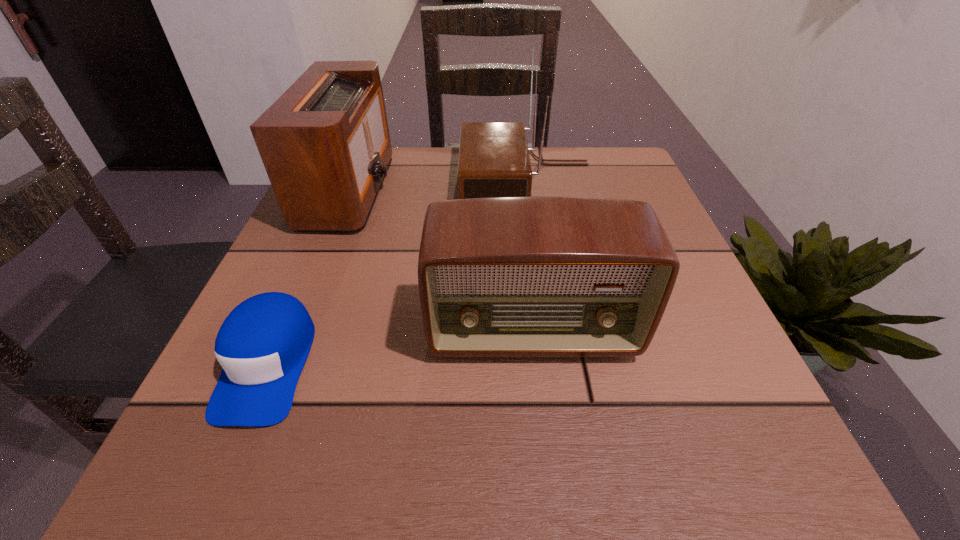
Locate which object ranks second in proximity to the nearest radio receiver. Please provide its 2D coordinates. Your answer should be formatted as a tuple, i.e. [(x, y)], where the tuple contains the x and y coordinates of a point satisfying the conditions above.

[(325, 144)]

Identify which object is the second closest to the leftmost radio receiver. Please provide its 2D coordinates. Your answer should be formatted as a tuple, i.e. [(x, y)], where the tuple contains the x and y coordinates of a point satisfying the conditions above.

[(262, 345)]

Select which radio receiver is the closest to the shortest object. Please provide its 2D coordinates. Your answer should be formatted as a tuple, i.e. [(x, y)], where the tuple contains the x and y coordinates of a point satisfying the conditions above.

[(502, 276)]

Locate an element on the screen. This screenshot has width=960, height=540. radio receiver that is the second closest to the leftmost radio receiver is located at coordinates (502, 276).